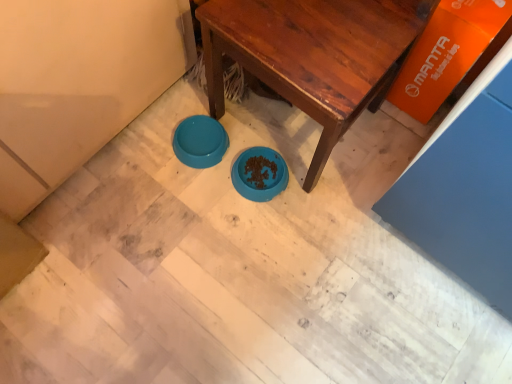
Locate an element on the screen. The width and height of the screenshot is (512, 384). free space on the front side of wooden table at center is located at coordinates (285, 236).